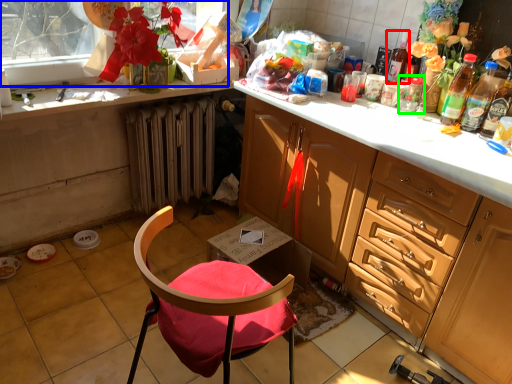
Question: Which object is positioned closest to bottle (highlighted by a red box)? Select from window screen (highlighted by a blue box) and glass jar (highlighted by a green box).

Choices:
 (A) window screen
 (B) glass jar

Answer: (B)